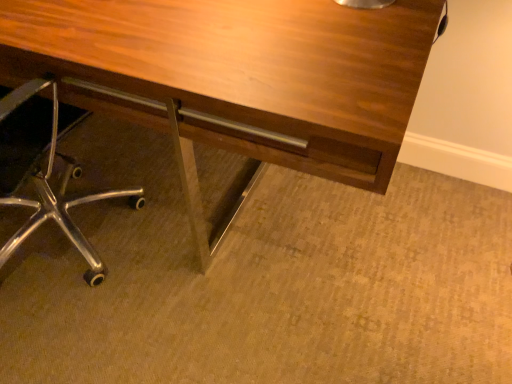
Question: Considering their positions, is wooden desk at center located in front of or behind metal/chrome chair at lower left?

Choices:
 (A) front
 (B) behind

Answer: (B)

Question: In the image, is wooden desk at center on the left side or the right side of metal/chrome chair at lower left?

Choices:
 (A) left
 (B) right

Answer: (B)

Question: From a real-world perspective, is wooden desk at center positioned above or below metal/chrome chair at lower left?

Choices:
 (A) below
 (B) above

Answer: (A)

Question: Is metal/chrome chair at lower left taller or shorter than wooden desk at center?

Choices:
 (A) tall
 (B) short

Answer: (A)

Question: Is metal/chrome chair at lower left wider or thinner than wooden desk at center?

Choices:
 (A) thin
 (B) wide

Answer: (A)

Question: From a real-world perspective, relative to wooden desk at center, is metal/chrome chair at lower left vertically above or below?

Choices:
 (A) below
 (B) above

Answer: (B)

Question: From the image's perspective, is metal/chrome chair at lower left located above or below wooden desk at center?

Choices:
 (A) above
 (B) below

Answer: (B)